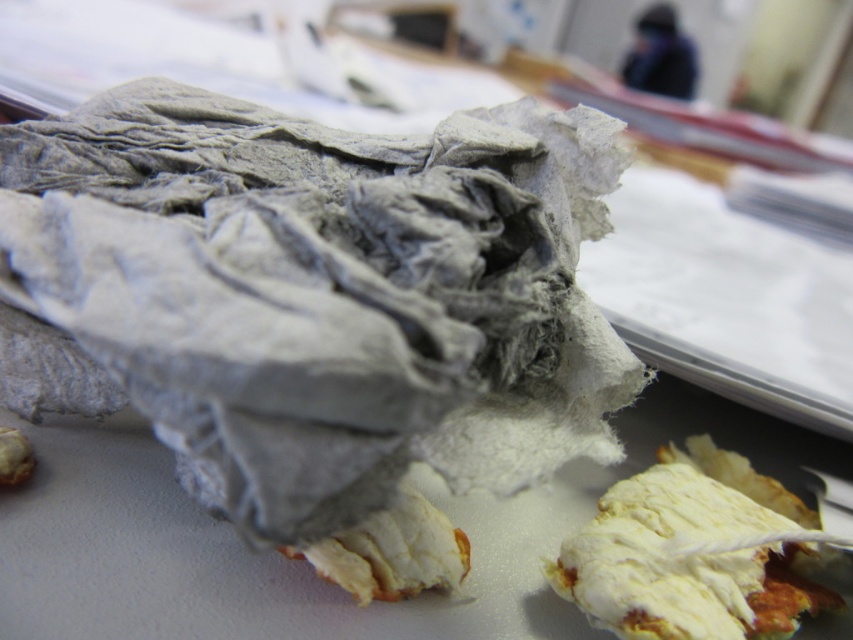
You are looking at the pizza crust pieces on the table. There are two points marked on the pizza crust pieces. One is at point (608,586) and the other is at point (368,532). From your perspective, which point is closer to you?

Point (608,586) is in front of point (368,532), so it is closer to you.

You are a baker trying to determine which ingredient to use next. You have two options on the counter in front of you. Which one is bigger between the white crumbly bread at lower right and the white crumbly dough at lower center?

The white crumbly bread at lower right is larger in size than the white crumbly dough at lower center, so the white crumbly bread at lower right is bigger.

You are trying to clean up the crumbs from the white crumbly bread at lower right and the white crumbly dough at lower center. Which object is located to the right of the other?

The white crumbly bread at lower right is to the right of the white crumbly dough at lower center.